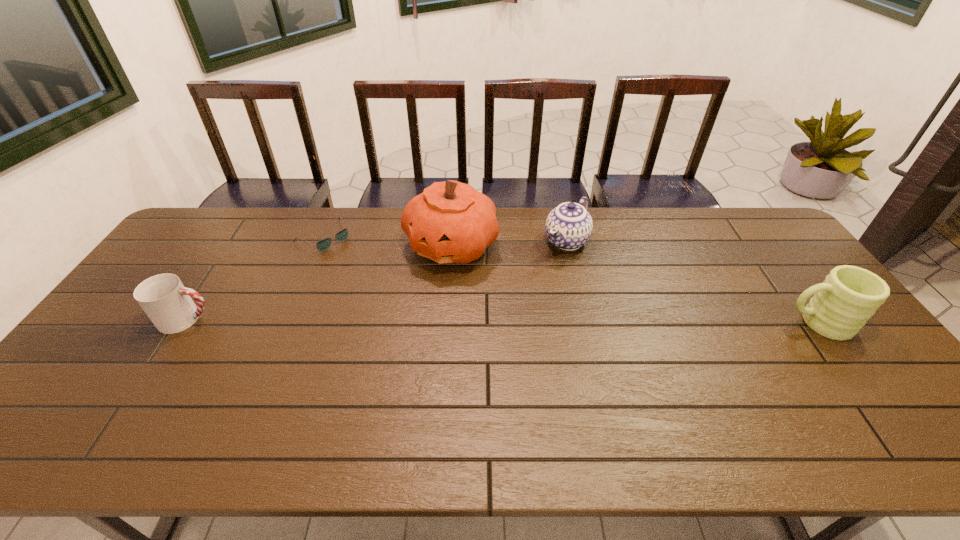
You are a GUI agent. You are given a task and a screenshot of the screen. Output one action in this format:
    pyautogui.click(x=<x>, y=<y>)
    Task: Click on the vacant space situated on the side of the mug with the handle
    This screenshot has width=960, height=540.
    Given the screenshot: What is the action you would take?
    pyautogui.click(x=735, y=323)

Locate an element on the screen. This screenshot has height=540, width=960. vacant space located on the side of the mug with the handle is located at coordinates click(761, 323).

Identify the location of vacant area situated 0.160m at the spout of the fourth object from left to right. (x=531, y=286).

Identify the location of blank space located at the spout of the fourth object from left to right. The width and height of the screenshot is (960, 540). (515, 303).

Where is `free location located 0.210m at the spout of the fourth object from left to right`? The width and height of the screenshot is (960, 540). free location located 0.210m at the spout of the fourth object from left to right is located at coordinates (522, 295).

At what (x,y) coordinates should I click in order to perform the action: click on vacant region located 0.130m on the front-facing side of the third object from right to left. Please return your answer as a coordinate pair (x, y). Looking at the image, I should click on (423, 306).

The image size is (960, 540). I want to click on blank space located 0.120m on the front-facing side of the third object from right to left, so click(424, 303).

The width and height of the screenshot is (960, 540). I want to click on free region located 0.150m on the front-facing side of the third object from right to left, so click(x=421, y=310).

Where is `vacant space situated on the lenses of the shortest object`? vacant space situated on the lenses of the shortest object is located at coordinates (387, 288).

You are a GUI agent. You are given a task and a screenshot of the screen. Output one action in this format:
    pyautogui.click(x=<x>, y=<y>)
    Task: Click on the free space located 0.330m on the lenses of the shortest object
    Image resolution: width=960 pixels, height=540 pixels.
    Given the screenshot: What is the action you would take?
    pyautogui.click(x=401, y=300)